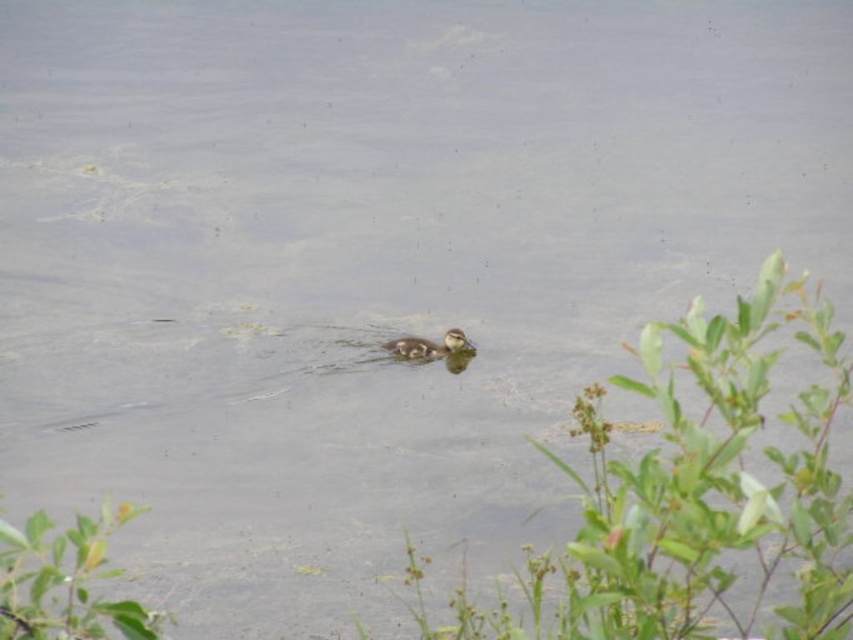
Who is shorter, green leafy plant at center or brown fuzzy duckling at center?

brown fuzzy duckling at center is shorter.

Is the position of green leafy plant at center less distant than that of brown fuzzy duckling at center?

Yes, it is in front of brown fuzzy duckling at center.

Between point (659, 516) and point (442, 346), which one is positioned behind?

The point (442, 346) is behind.

Find the location of a particular element. Image resolution: width=853 pixels, height=640 pixels. green leafy plant at center is located at coordinates (694, 497).

Based on the photo, measure the distance between point (12,611) and camera.

Point (12,611) and camera are 4.71 feet apart.

Between green leafy plant at lower left and brown fuzzy duckling at center, which one has less height?

brown fuzzy duckling at center

At what (x,y) coordinates should I click in order to perform the action: click on green leafy plant at lower left. Please return your answer as a coordinate pair (x, y). This screenshot has height=640, width=853. Looking at the image, I should click on (65, 580).

Is green leafy plant at center further to the viewer compared to green leafy plant at lower left?

No, it is not.

Does point (825, 328) lie behind point (16, 620)?

Yes, point (825, 328) is behind point (16, 620).

Identify the location of green leafy plant at center. Image resolution: width=853 pixels, height=640 pixels. (694, 497).